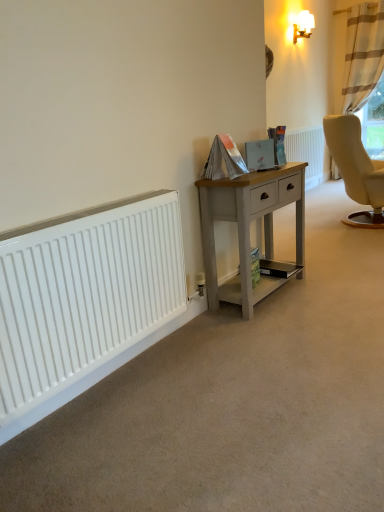
Question: Considering the relative positions of light gray wood desk at center and beige striped curtain at upper right in the image provided, is light gray wood desk at center to the left of beige striped curtain at upper right from the viewer's perspective?

Choices:
 (A) no
 (B) yes

Answer: (B)

Question: Is light gray wood desk at center closer to camera compared to beige striped curtain at upper right?

Choices:
 (A) yes
 (B) no

Answer: (A)

Question: From a real-world perspective, is light gray wood desk at center on beige striped curtain at upper right?

Choices:
 (A) yes
 (B) no

Answer: (B)

Question: From the image's perspective, is light gray wood desk at center above beige striped curtain at upper right?

Choices:
 (A) yes
 (B) no

Answer: (B)

Question: Considering the relative sizes of light gray wood desk at center and beige striped curtain at upper right in the image provided, is light gray wood desk at center thinner than beige striped curtain at upper right?

Choices:
 (A) no
 (B) yes

Answer: (B)

Question: From the image's perspective, is white smooth radiator at lower left, the first radiator in the left-to-right sequence, positioned above or below white textured radiator at center, which ranks as the first radiator in top-to-bottom order?

Choices:
 (A) below
 (B) above

Answer: (A)

Question: In terms of size, does white smooth radiator at lower left, which is the second radiator from top to bottom, appear bigger or smaller than white textured radiator at center, the 1th radiator from the back?

Choices:
 (A) small
 (B) big

Answer: (A)

Question: In the image, is white smooth radiator at lower left, positioned as the second radiator in back-to-front order, positioned in front of or behind white textured radiator at center, the 1th radiator from the back?

Choices:
 (A) front
 (B) behind

Answer: (A)

Question: Is white smooth radiator at lower left, positioned as the second radiator in back-to-front order, wider or thinner than white textured radiator at center, the 1th radiator positioned from the right?

Choices:
 (A) thin
 (B) wide

Answer: (A)

Question: Considering the relative positions of white glossy wall lamp at upper right and white textured radiator at center, the second radiator viewed from the left, in the image provided, is white glossy wall lamp at upper right to the left or to the right of white textured radiator at center, the second radiator viewed from the left,?

Choices:
 (A) left
 (B) right

Answer: (A)

Question: Considering the positions of point (302, 11) and point (319, 125), is point (302, 11) closer or farther from the camera than point (319, 125)?

Choices:
 (A) closer
 (B) farther

Answer: (A)

Question: From a real-world perspective, is white glossy wall lamp at upper right above or below white textured radiator at center, placed as the second radiator when sorted from front to back?

Choices:
 (A) above
 (B) below

Answer: (A)

Question: Is white glossy wall lamp at upper right wider or thinner than white textured radiator at center, the 1th radiator from the back?

Choices:
 (A) wide
 (B) thin

Answer: (A)

Question: Is beige striped curtain at upper right bigger or smaller than white textured radiator at center, placed as the second radiator when sorted from front to back?

Choices:
 (A) big
 (B) small

Answer: (A)

Question: Is beige striped curtain at upper right to the left or to the right of white textured radiator at center, which ranks as the first radiator in top-to-bottom order, in the image?

Choices:
 (A) left
 (B) right

Answer: (B)